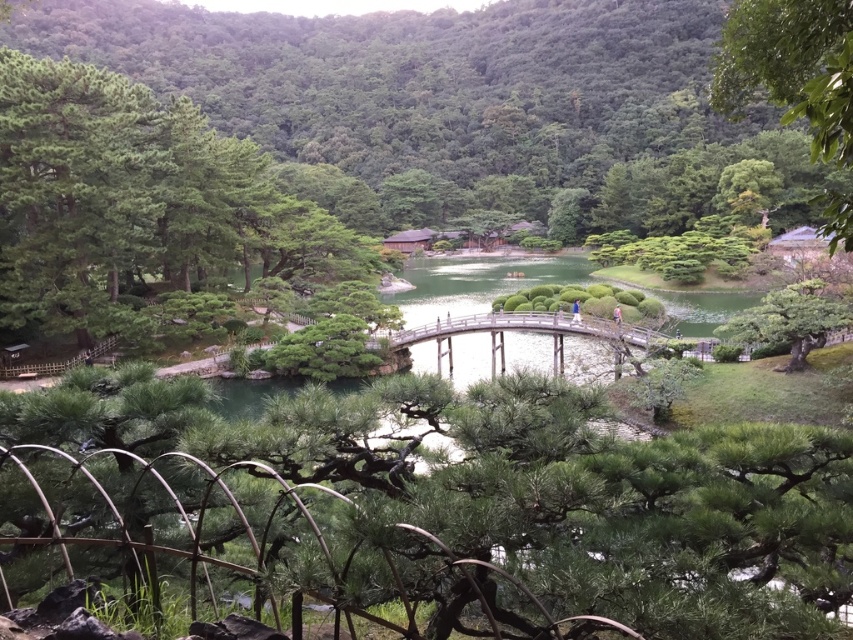
You are a GUI agent. You are given a task and a screenshot of the screen. Output one action in this format:
    pyautogui.click(x=<x>, y=<y>)
    Task: Click on the green textured pine tree at left
    Image resolution: width=853 pixels, height=640 pixels.
    Given the screenshot: What is the action you would take?
    pyautogui.click(x=140, y=209)

Who is positioned more to the right, green textured pine tree at left or green leafy tree at upper right?

Positioned to the right is green leafy tree at upper right.

Find the location of `green textured pine tree at left`. green textured pine tree at left is located at coordinates (140, 209).

Does green leafy tree at upper right have a lesser height compared to wooden bridge at center?

In fact, green leafy tree at upper right may be taller than wooden bridge at center.

Identify the location of green leafy tree at upper right. (791, 67).

Is green textured pine tree at left smaller than wooden bridge at center?

Incorrect, green textured pine tree at left is not smaller in size than wooden bridge at center.

Between point (122, 269) and point (647, 330), which one is positioned behind?

Point (122, 269)

This screenshot has height=640, width=853. What do you see at coordinates (140, 209) in the screenshot?
I see `green textured pine tree at left` at bounding box center [140, 209].

The width and height of the screenshot is (853, 640). Find the location of `green textured pine tree at left`. green textured pine tree at left is located at coordinates (140, 209).